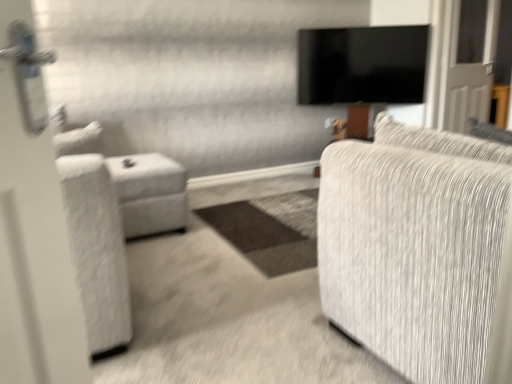
Where is `textured gray fabric couch at right`? This screenshot has height=384, width=512. textured gray fabric couch at right is located at coordinates click(414, 247).

From a real-world perspective, which object rests below the other?

white fabric ottoman at left is physically lower.

Could you tell me if white fabric ottoman at left is turned towards black glossy tv at upper center?

Yes, white fabric ottoman at left is aimed at black glossy tv at upper center.

Is white fabric ottoman at left taller than black glossy tv at upper center?

In fact, white fabric ottoman at left may be shorter than black glossy tv at upper center.

Which is further, (180, 192) or (308, 75)?

The point (308, 75) is farther from the camera.

From the image's perspective, is black glossy tv at upper center on white fabric ottoman at left?

Indeed, from the image's perspective, black glossy tv at upper center is shown above white fabric ottoman at left.

Between point (407, 97) and point (144, 193), which one is positioned behind?

Positioned behind is point (407, 97).

From a real-world perspective, is black glossy tv at upper center positioned over white fabric ottoman at left based on gravity?

Yes, from a real-world perspective, black glossy tv at upper center is on top of white fabric ottoman at left.

Can you confirm if black glossy tv at upper center is smaller than white fabric ottoman at left?

A: Correct, black glossy tv at upper center occupies less space than white fabric ottoman at left.

Is black glossy tv at upper center aimed at textured gray fabric couch at right?

Yes, black glossy tv at upper center is oriented towards textured gray fabric couch at right.

Considering the sizes of objects black glossy tv at upper center and textured gray fabric couch at right in the image provided, who is smaller, black glossy tv at upper center or textured gray fabric couch at right?

Smaller between the two is black glossy tv at upper center.

Between black glossy tv at upper center and textured gray fabric couch at right, which one has more height?

With more height is textured gray fabric couch at right.

Is white fabric ottoman at left next to textured gray fabric couch at right and touching it?

No, white fabric ottoman at left is not beside textured gray fabric couch at right.

From a real-world perspective, is white fabric ottoman at left positioned above or below textured gray fabric couch at right?

In terms of real-world spatial position, white fabric ottoman at left is below textured gray fabric couch at right.

Is white fabric ottoman at left thinner than textured gray fabric couch at right?

Correct, the width of white fabric ottoman at left is less than that of textured gray fabric couch at right.

From the image's perspective, is white fabric ottoman at left on top of textured gray fabric couch at right?

Yes, from the image's perspective, white fabric ottoman at left is above textured gray fabric couch at right.

Considering the points (375, 170) and (325, 29), which point is in front, point (375, 170) or point (325, 29)?

The point (375, 170) is closer.

Is textured gray fabric couch at right next to black glossy tv at upper center and touching it?

There is a gap between textured gray fabric couch at right and black glossy tv at upper center.

From a real-world perspective, who is located higher, textured gray fabric couch at right or black glossy tv at upper center?

From a 3D spatial view, black glossy tv at upper center is above.

Does textured gray fabric couch at right have a greater height compared to black glossy tv at upper center?

Indeed, textured gray fabric couch at right has a greater height compared to black glossy tv at upper center.

From a real-world perspective, is textured gray fabric couch at right physically above white fabric ottoman at left?

Yes, from a real-world perspective, textured gray fabric couch at right is on top of white fabric ottoman at left.

Does point (495, 144) come behind point (156, 222)?

No, it is in front of (156, 222).

Based on their positions, is textured gray fabric couch at right located to the left or right of white fabric ottoman at left?

Based on their positions, textured gray fabric couch at right is located to the right of white fabric ottoman at left.

In the scene shown: Do you think textured gray fabric couch at right is within white fabric ottoman at left, or outside of it?

textured gray fabric couch at right lies outside white fabric ottoman at left.

This screenshot has height=384, width=512. What are the coordinates of `table that appears below the black glossy tv at upper center (from a real-world perspective)` in the screenshot? It's located at (150, 193).

This screenshot has width=512, height=384. I want to click on table below the black glossy tv at upper center (from the image's perspective), so click(x=150, y=193).

Considering their positions, is black glossy tv at upper center positioned closer to white fabric ottoman at left than textured gray fabric couch at right?

textured gray fabric couch at right.

Based on their spatial positions, is textured gray fabric couch at right or white fabric ottoman at left further from black glossy tv at upper center?

The object further to black glossy tv at upper center is textured gray fabric couch at right.

When comparing their distances from textured gray fabric couch at right, does black glossy tv at upper center or white fabric ottoman at left seem further?

black glossy tv at upper center is positioned further to the anchor textured gray fabric couch at right.

Which object lies nearer to the anchor point textured gray fabric couch at right, white fabric ottoman at left or black glossy tv at upper center?

white fabric ottoman at left is closer to textured gray fabric couch at right.

When comparing their distances from white fabric ottoman at left, does textured gray fabric couch at right or black glossy tv at upper center seem closer?

textured gray fabric couch at right is positioned closer to the anchor white fabric ottoman at left.

Estimate the real-world distances between objects in this image. Which object is closer to black glossy tv at upper center, white fabric ottoman at left or textured gray fabric couch at right?

The object closer to black glossy tv at upper center is white fabric ottoman at left.

Locate an element on the screen. table between textured gray fabric couch at right and black glossy tv at upper center from front to back is located at coordinates (150, 193).